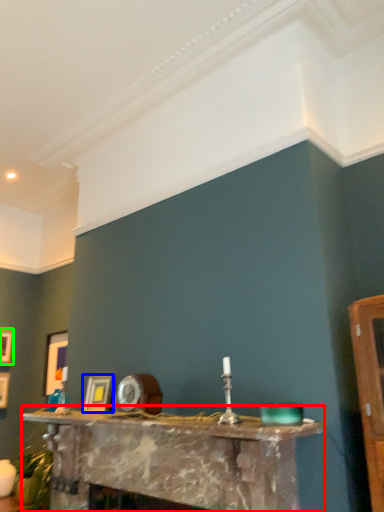
Question: Which object is the closest to the table (highlighted by a red box)? Choose among these: picture frame (highlighted by a blue box) or picture frame (highlighted by a green box).

Choices:
 (A) picture frame
 (B) picture frame

Answer: (A)